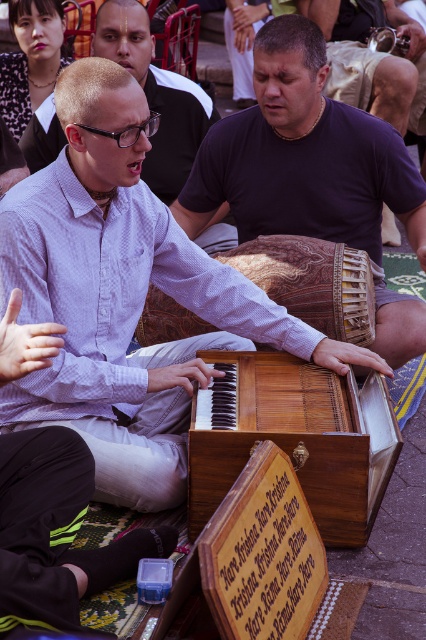
From the picture: You are a street performer who wants to place a new instrument between the wooden piano at center and the wooden drum at center. Which side should you place it on to ensure it fits better?

The wooden piano at center is wider than the wooden drum at center. Therefore, placing the new instrument between them should be on the side of the wooden drum at center to accommodate the space better.